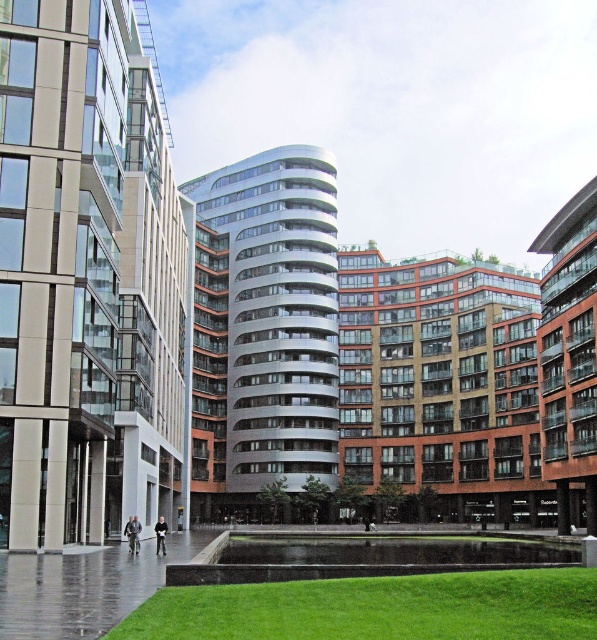
You are a fashion designer observing two jackets in an urban setting. You need to determine which jacket is shorter. The jackets are the light gray fabric jacket at lower center and the dark gray jacket at center. Which one is shorter?

The light gray fabric jacket at lower center is shorter than the dark gray jacket at center.

You are standing in the urban landscape and want to know which of the two points, point (x=131, y=525) or point (x=164, y=524), is closer to you. Can you determine this based on their positions?

Point (x=131, y=525) is further to the camera than point (x=164, y=524), so the closer point is point (x=164, y=524).